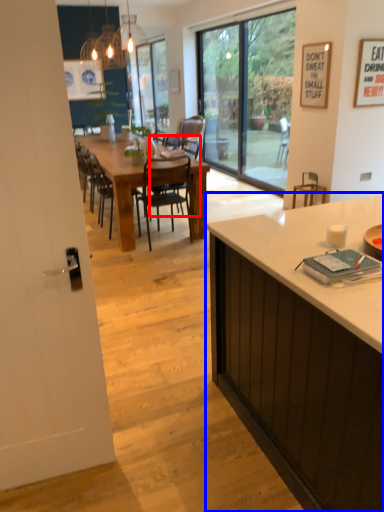
Question: Which object is closer to the camera taking this photo, chair (highlighted by a red box) or cabinetry (highlighted by a blue box)?

Choices:
 (A) chair
 (B) cabinetry

Answer: (B)